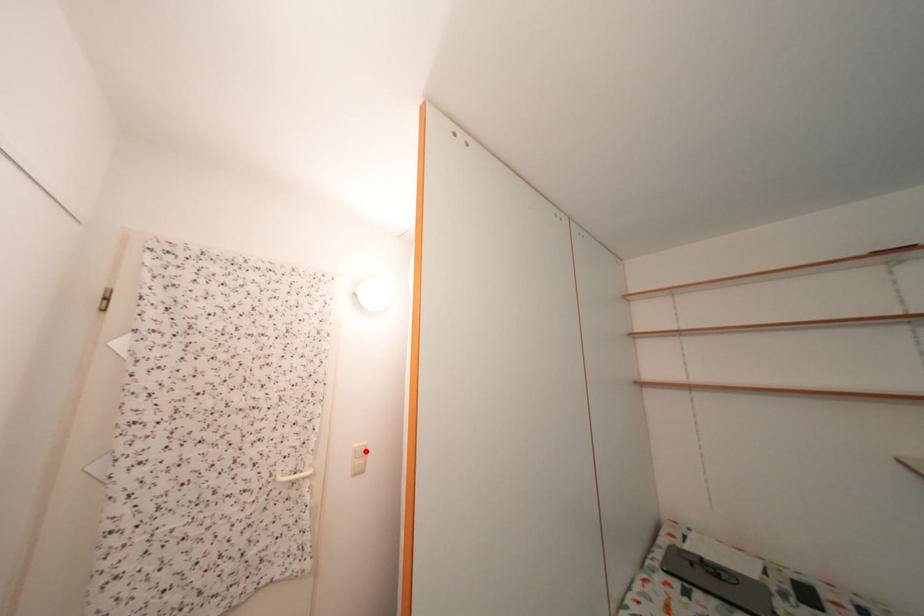
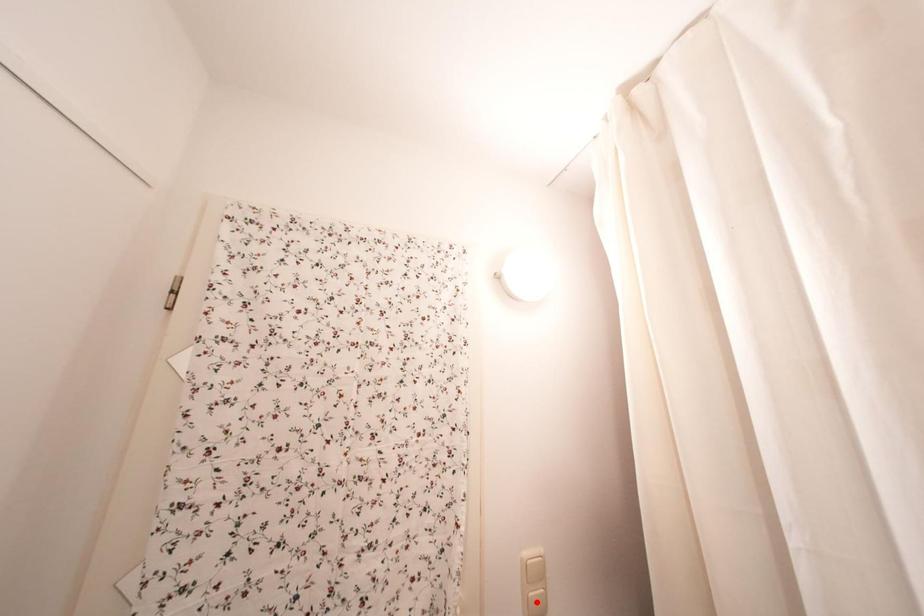
I am providing you with two images of the same scene from different viewpoints. A red point is marked on the first image and another point is marked on the second image. Is the red point in image1 aligned with the point shown in image2?

No